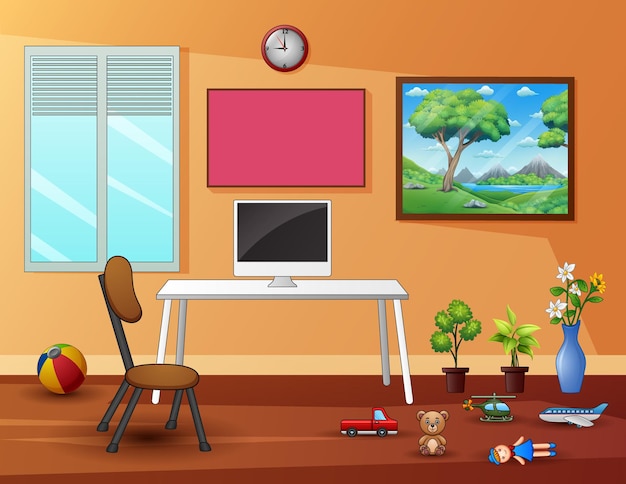
Locate an element on the screen. white desk is located at coordinates (177, 295).